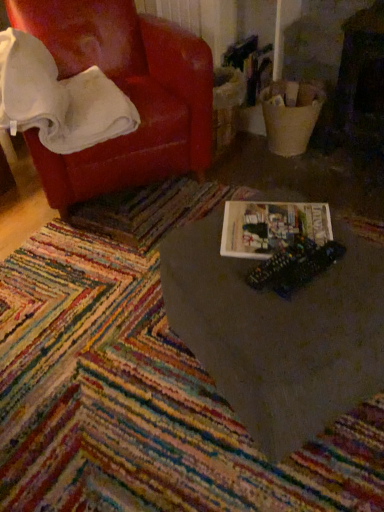
What are the coordinates of `vacant area on top of multicolored woven mat at center (from a real-world perspective)` in the screenshot? It's located at (114, 294).